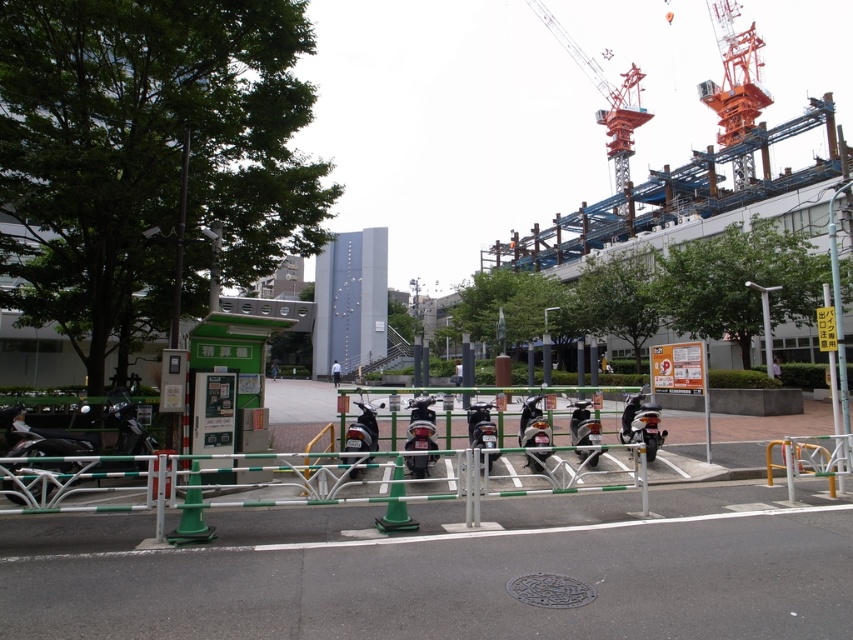
Is orange metallic crane at upper right positioned before white matte person at center?

That is False.

Which is in front, point (624, 104) or point (334, 385)?

Point (334, 385) is more forward.

Between point (564, 38) and point (332, 372), which one is positioned behind?

Point (564, 38)

Find the location of a particular element. The height and width of the screenshot is (640, 853). orange metallic crane at upper right is located at coordinates (606, 99).